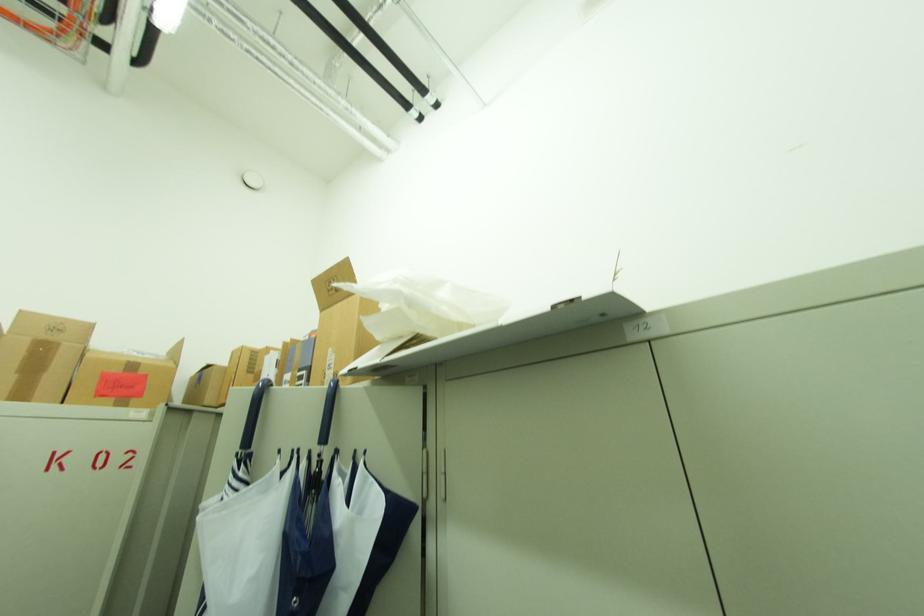
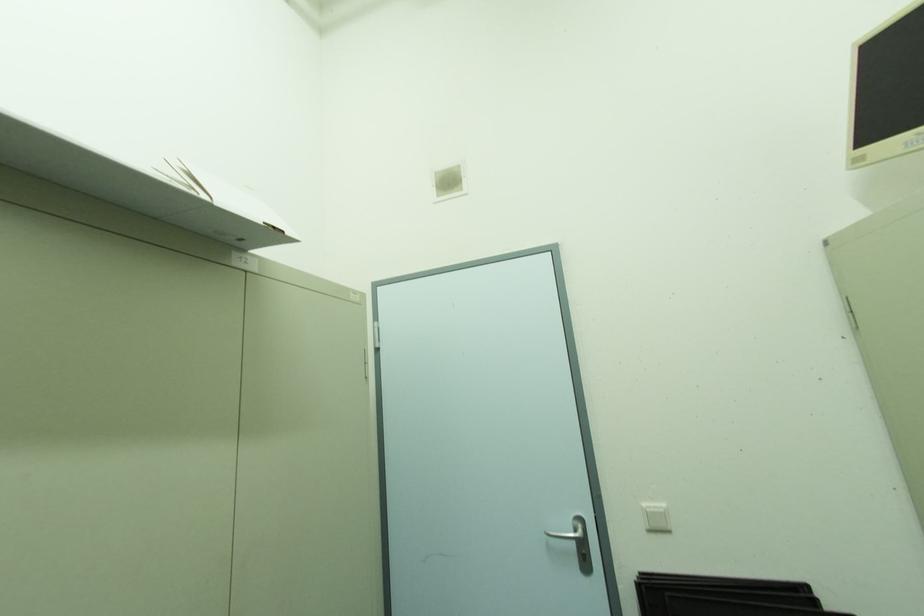
Based on the continuous images, in which direction is the camera rotating?

The camera's rotation is toward right-up.